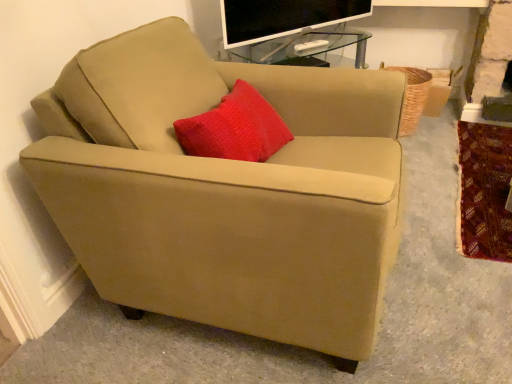
Question: From a real-world perspective, is flat-screen tv at upper center physically located above or below suede beige armchair at center?

Choices:
 (A) below
 (B) above

Answer: (B)

Question: In terms of width, does flat-screen tv at upper center look wider or thinner when compared to suede beige armchair at center?

Choices:
 (A) thin
 (B) wide

Answer: (A)

Question: Which is farther from the suede beige armchair at center?

Choices:
 (A) velvet-like red blanket at lower right
 (B) woven brown basket at right
 (C) flat-screen tv at upper center

Answer: (B)

Question: Which is nearer to the woven brown basket at right?

Choices:
 (A) suede beige armchair at center
 (B) flat-screen tv at upper center
 (C) velvet-like red blanket at lower right

Answer: (C)